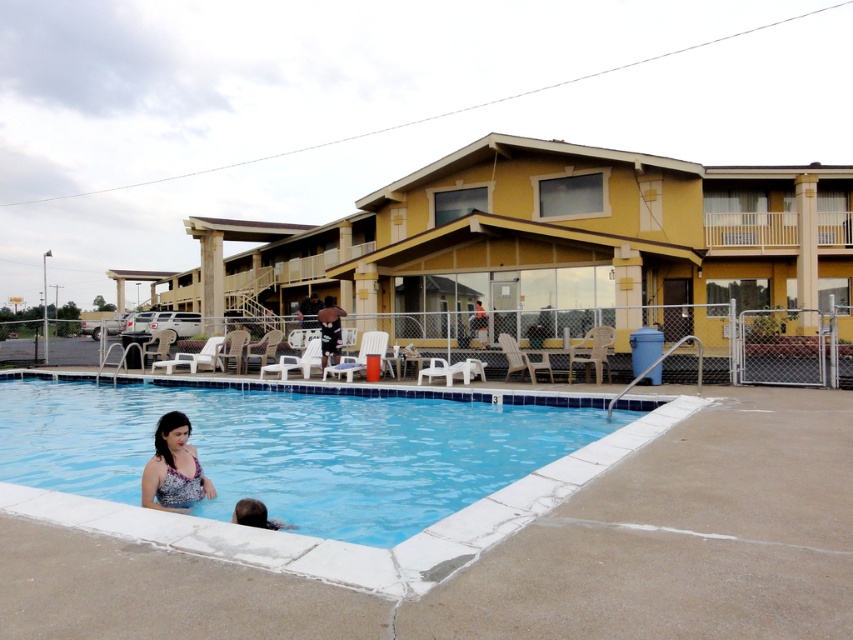
Question: Among these points, which one is farthest from the camera?

Choices:
 (A) (192, 476)
 (B) (241, 508)
 (C) (412, 509)

Answer: (C)

Question: Observing the image, what is the correct spatial positioning of blue tile swimming pool at lower left in reference to matte floral swimsuit at lower left?

Choices:
 (A) above
 (B) below

Answer: (B)

Question: Is matte floral swimsuit at lower left wider than brown hair at lower left?

Choices:
 (A) no
 (B) yes

Answer: (B)

Question: Is blue tile swimming pool at lower left above matte floral swimsuit at lower left?

Choices:
 (A) no
 (B) yes

Answer: (A)

Question: Which object is the closest to the blue tile swimming pool at lower left?

Choices:
 (A) matte floral swimsuit at lower left
 (B) brown hair at lower left

Answer: (A)

Question: Considering the real-world distances, which object is closest to the blue tile swimming pool at lower left?

Choices:
 (A) brown hair at lower left
 (B) matte floral swimsuit at lower left

Answer: (B)